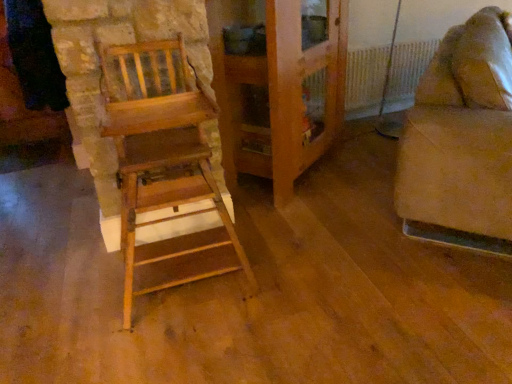
Question: Is wooden cabinet at center wider or thinner than wooden chair at left, marked as the 2th furniture in a right-to-left arrangement?

Choices:
 (A) wide
 (B) thin

Answer: (B)

Question: In the image, is wooden cabinet at center positioned in front of or behind wooden chair at left, placed as the 1th furniture when sorted from left to right?

Choices:
 (A) behind
 (B) front

Answer: (A)

Question: Which is farther from the white plastic radiator at upper right?

Choices:
 (A) wooden chair at left, placed as the 1th furniture when sorted from left to right
 (B) beige fabric couch at right, placed as the 2th furniture when sorted from left to right
 (C) wooden cabinet at center

Answer: (A)

Question: Considering the real-world distances, which object is farthest from the beige fabric couch at right, placed as the 2th furniture when sorted from left to right?

Choices:
 (A) white plastic radiator at upper right
 (B) wooden cabinet at center
 (C) wooden chair at left, placed as the 1th furniture when sorted from left to right

Answer: (A)